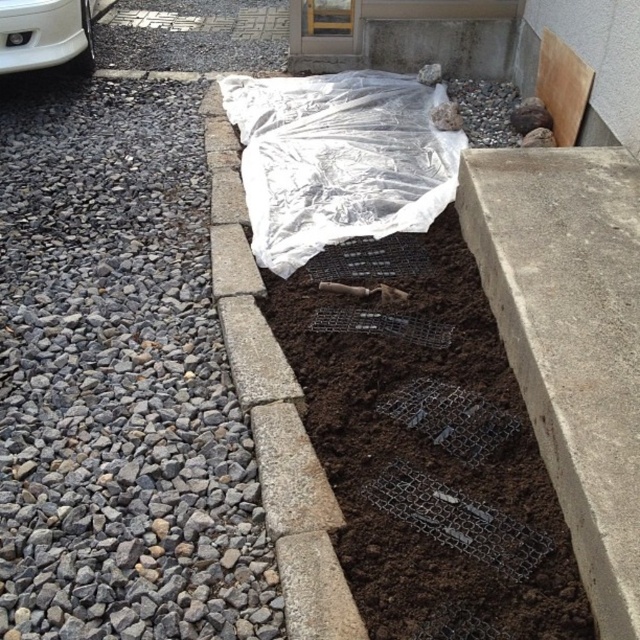
Question: Can you confirm if transparent plastic at center is positioned to the right of gray concrete curb at center?

Choices:
 (A) yes
 (B) no

Answer: (A)

Question: Is transparent plastic at center further to the viewer compared to white glossy bumper at upper left?

Choices:
 (A) no
 (B) yes

Answer: (A)

Question: Which object is closer to the camera taking this photo?

Choices:
 (A) transparent plastic at center
 (B) white glossy bumper at upper left

Answer: (A)

Question: Does gray concrete curb at center appear under white glossy bumper at upper left?

Choices:
 (A) no
 (B) yes

Answer: (B)

Question: Which object is closer to the camera taking this photo?

Choices:
 (A) gray concrete curb at center
 (B) white glossy bumper at upper left

Answer: (A)

Question: Which point appears farthest from the camera in this image?

Choices:
 (A) [x=296, y=384]
 (B) [x=460, y=134]
 (C) [x=90, y=1]

Answer: (C)